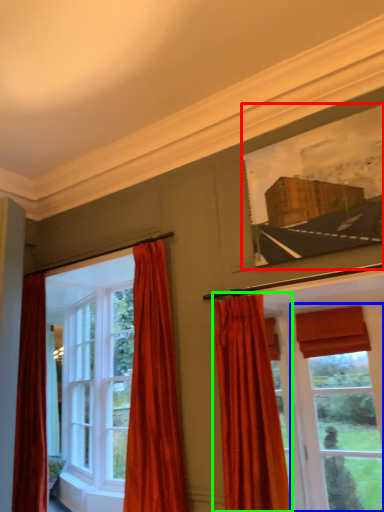
Question: Which object is positioned closest to picture frame (highlighted by a red box)? Select from window (highlighted by a blue box) and curtain (highlighted by a green box).

Choices:
 (A) window
 (B) curtain

Answer: (B)